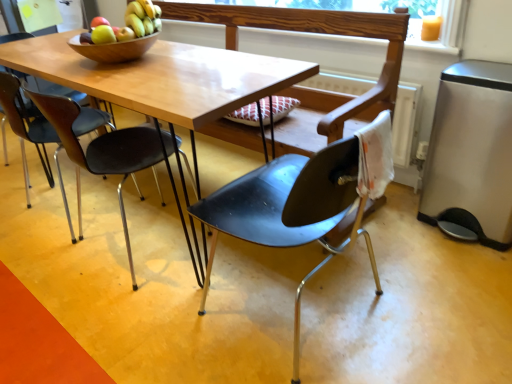
Question: In the image, is black plastic chair at left, the 2th chair viewed from the left, positioned in front of or behind matte black chair at center, which is the 3th chair in left-to-right order?

Choices:
 (A) front
 (B) behind

Answer: (B)

Question: Is black plastic chair at left, the 2th chair viewed from the left, situated inside matte black chair at center, acting as the 1th chair starting from the right, or outside?

Choices:
 (A) inside
 (B) outside

Answer: (B)

Question: Estimate the real-world distances between objects in this image. Which object is closer to the stainless steel trash can at right?

Choices:
 (A) black plastic chair at left, which appears as the second chair when viewed from the right
 (B) matte black chair at center, acting as the 1th chair starting from the right
 (C) matte black chair at left, acting as the 3th chair starting from the right
 (D) wooden frame at upper center

Answer: (D)

Question: Which object is the farthest from the black plastic chair at left, which appears as the second chair when viewed from the right?

Choices:
 (A) stainless steel trash can at right
 (B) matte black chair at left, acting as the 3th chair starting from the right
 (C) wooden frame at upper center
 (D) matte black chair at center, acting as the 1th chair starting from the right

Answer: (A)